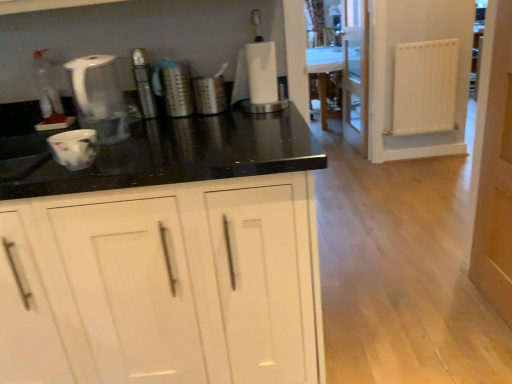
Where is `free spot below white matte radiator at right (from a real-world perspective)`? The height and width of the screenshot is (384, 512). free spot below white matte radiator at right (from a real-world perspective) is located at coordinates (418, 152).